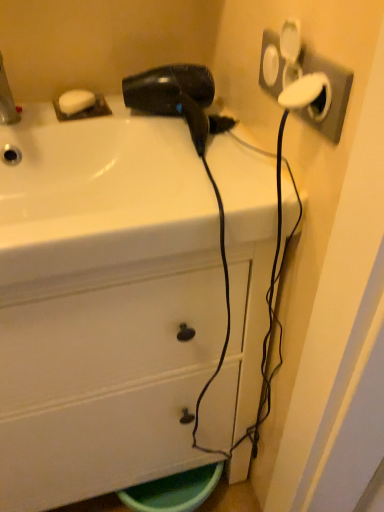
This screenshot has height=512, width=384. I want to click on vacant space to the right of brushed metal faucet at upper left, so click(x=71, y=120).